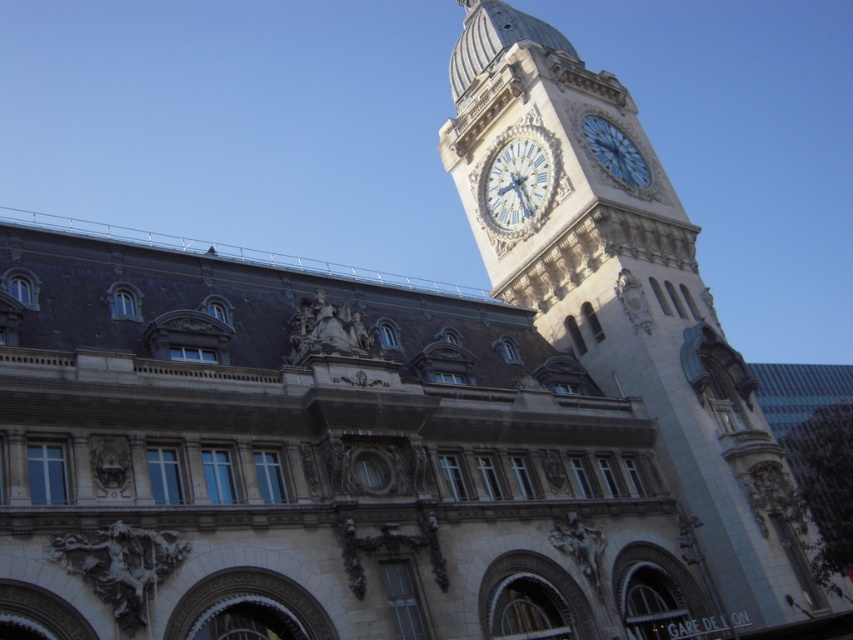
You are standing in front of the grand building and want to locate the stone clock tower at upper right. What are its coordinates in the image?

The stone clock tower at upper right is located at coordinates point (628, 300).

You are an architect designing a new building and want to place a new clock between the white marble clock at upper center and the blue glass clock at upper right. Which clock should you use as a reference for the new clock to ensure it is wider than both?

The blue glass clock at upper right is wider than the white marble clock at upper center, so you should use the blue glass clock at upper right as the reference to ensure the new clock is wider than both.

You are a maintenance worker needing to replace the batteries of both the white marble clock at upper center and the blue glass clock at upper right. The ladder you have can reach up to 7 meters. Can you safely reach both clocks with the ladder you have?

The white marble clock at upper center is 7.33 meters from the blue glass clock at upper right. Since the ladder can only reach up to 7 meters, you cannot safely reach both clocks with the ladder you have.